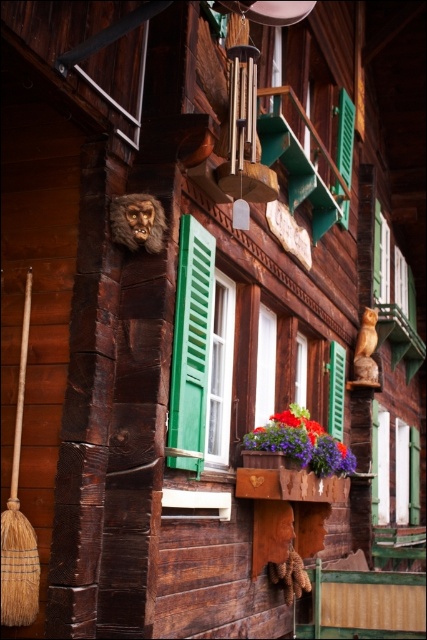
Question: Where is vivid purple petals at center located in relation to wooden flower box at center in the image?

Choices:
 (A) right
 (B) left

Answer: (B)

Question: Can you confirm if wooden flower box at center is wider than green wood shutter at center?

Choices:
 (A) no
 (B) yes

Answer: (B)

Question: Can you confirm if green matte shutter at center is bigger than wooden flower box at center?

Choices:
 (A) yes
 (B) no

Answer: (B)

Question: Based on their relative distances, which object is nearer to the green wood shutter at center?

Choices:
 (A) green wooden window at center
 (B) vivid purple petals at center
 (C) green matte shutter at center
 (D) wooden flower box at center

Answer: (B)

Question: Which object is farther from the camera taking this photo?

Choices:
 (A) green wooden window at center
 (B) wooden flower box at center

Answer: (A)

Question: Which object is farther from the camera taking this photo?

Choices:
 (A) green wood shutter at center
 (B) vivid purple petals at center
 (C) green matte shutter at center

Answer: (A)